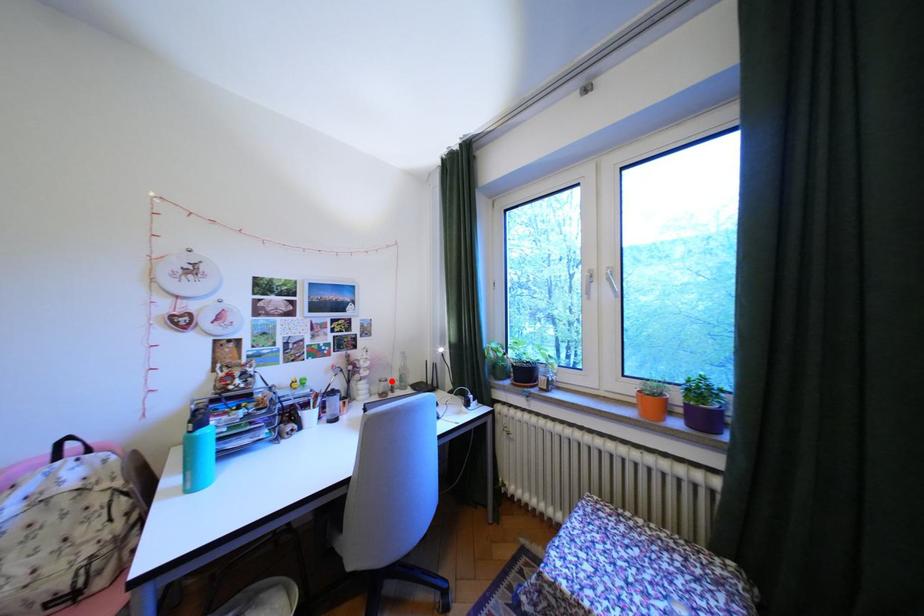
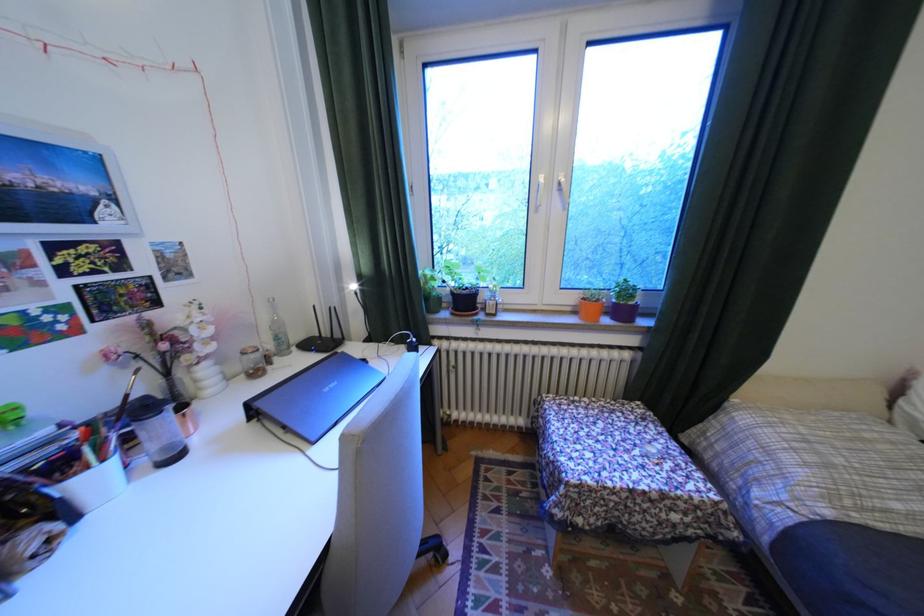
Locate, in the second image, the point that corresponds to the highlighted location in the first image.

(254, 354)